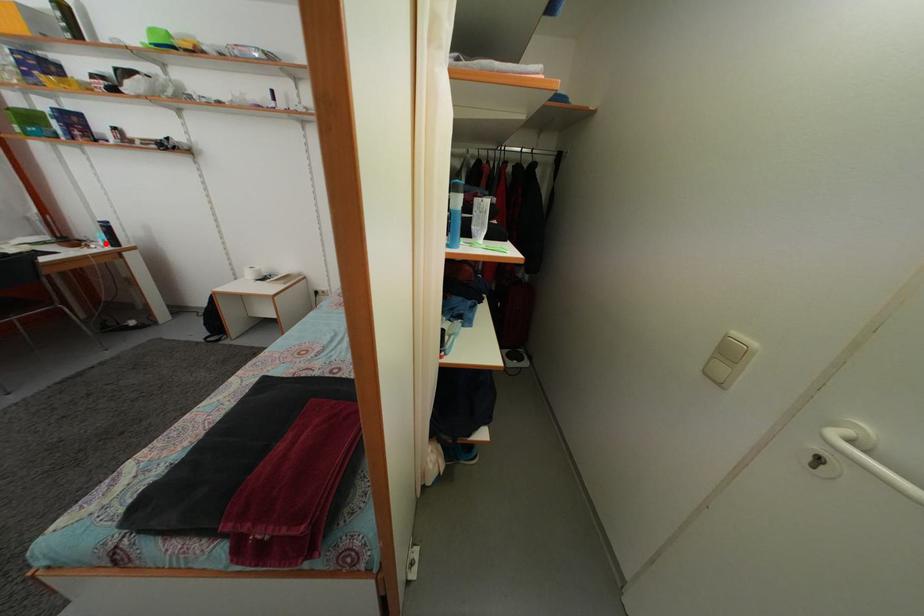
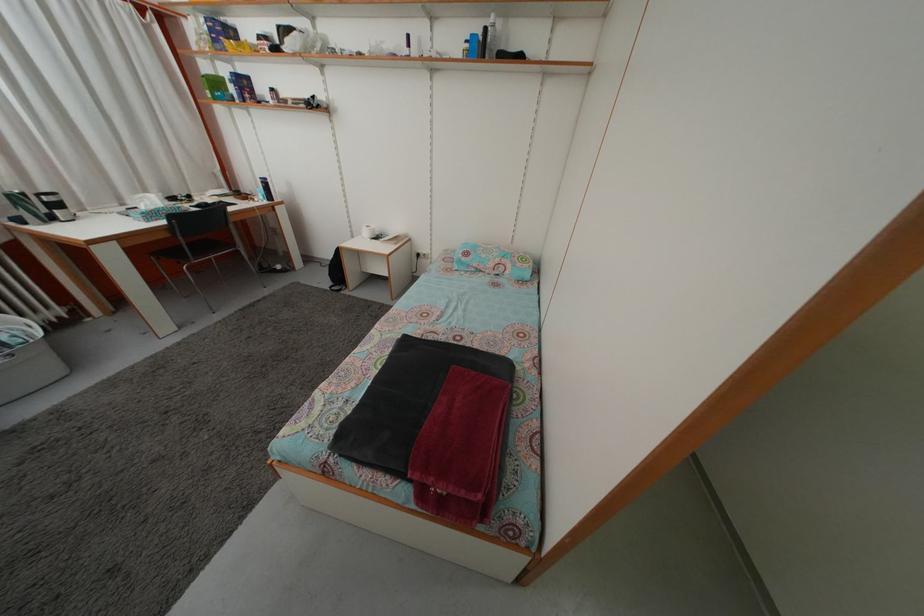
Find the pixel in the second image that matches the highlighted location in the first image.

(266, 199)